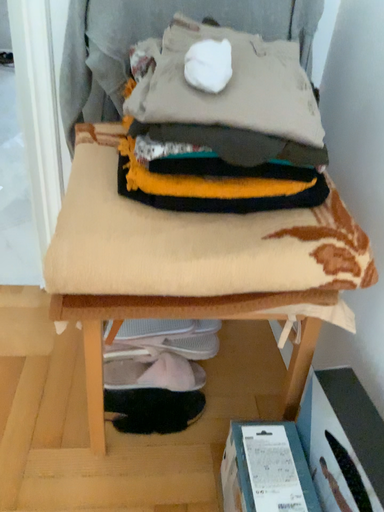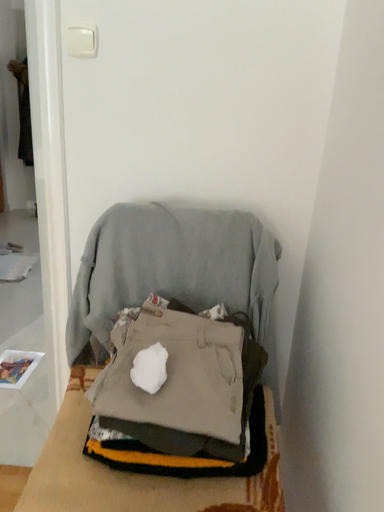
Question: How did the camera likely rotate when shooting the video?

Choices:
 (A) rotated downward
 (B) rotated upward

Answer: (B)